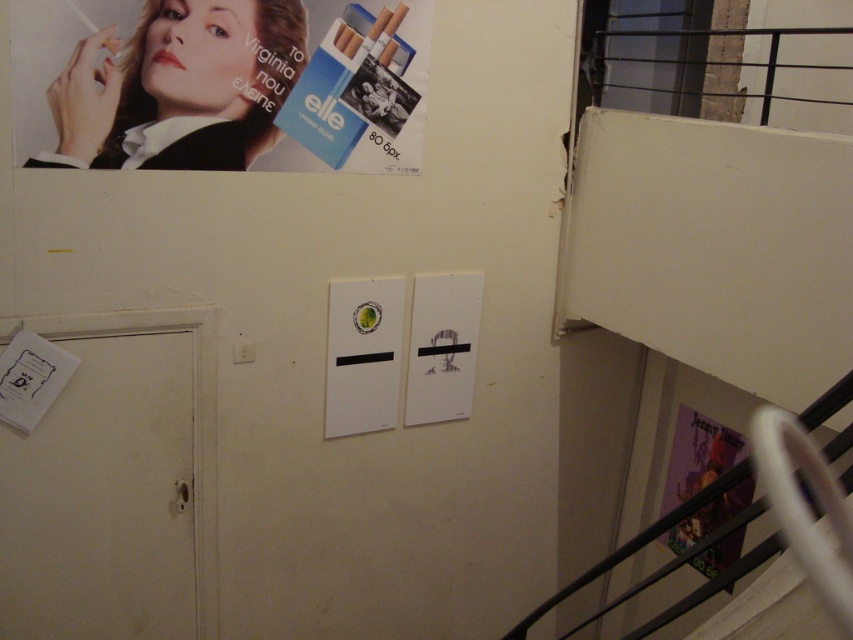
Who is shorter, white paper at center or purple glossy poster at lower right?

white paper at center is shorter.

Consider the image. Who is positioned more to the right, white paper at center or purple glossy poster at lower right?

Positioned to the right is purple glossy poster at lower right.

Does point (422, 358) come behind point (706, 474)?

No, (422, 358) is in front of (706, 474).

Find the location of `white paper at center`. white paper at center is located at coordinates (442, 346).

Does matte black poster at upper left have a greater height compared to white paper at center?

No.

Between matte black poster at upper left and white paper at center, which one is positioned lower?

white paper at center is lower down.

The image size is (853, 640). Describe the element at coordinates (180, 86) in the screenshot. I see `matte black poster at upper left` at that location.

Where is `matte black poster at upper left`? The image size is (853, 640). matte black poster at upper left is located at coordinates (180, 86).

Does white matte sign at center have a smaller size compared to purple glossy poster at lower right?

Correct, white matte sign at center occupies less space than purple glossy poster at lower right.

Which of these two, white matte sign at center or purple glossy poster at lower right, stands shorter?

Standing shorter between the two is white matte sign at center.

This screenshot has width=853, height=640. In order to click on white matte sign at center in this screenshot , I will do `click(363, 355)`.